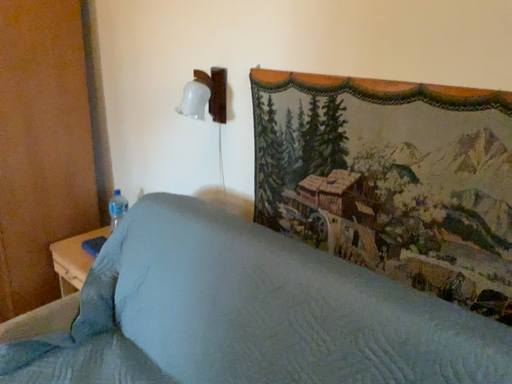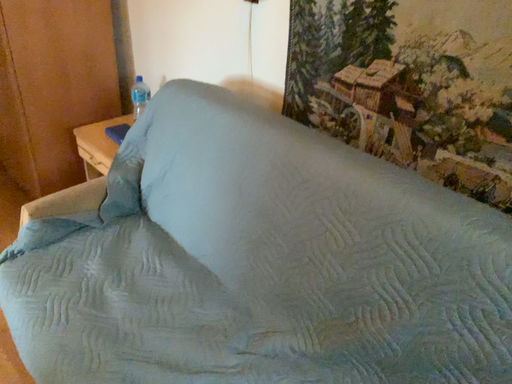
Question: How did the camera likely rotate when shooting the video?

Choices:
 (A) rotated upward
 (B) rotated downward

Answer: (B)